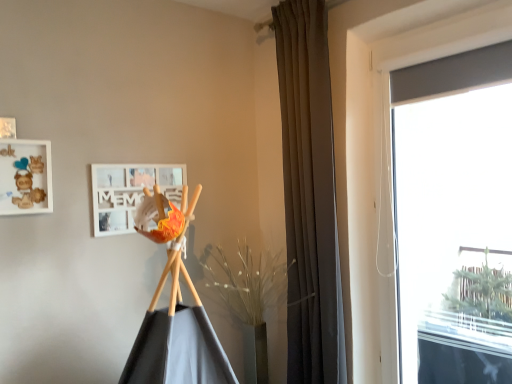
What do you see at coordinates (454, 217) in the screenshot? I see `transparent glass window at right` at bounding box center [454, 217].

Describe the element at coordinates (25, 177) in the screenshot. I see `wooden frame at upper left, marked as the 2th picture frame in a right-to-left arrangement` at that location.

Describe the element at coordinates (130, 193) in the screenshot. I see `white matte picture frame at upper center, which ranks as the second picture frame in front-to-back order` at that location.

Where is `brown fabric curtain at center`? This screenshot has width=512, height=384. brown fabric curtain at center is located at coordinates (309, 196).

In the scene shown: Between brown fabric curtain at center and wooden frame at upper left, the second picture frame viewed from the back, which one is positioned behind?

brown fabric curtain at center is behind.

Is brown fabric curtain at center oriented away from wooden frame at upper left, the second picture frame viewed from the back?

No, wooden frame at upper left, the second picture frame viewed from the back, is not at the back of brown fabric curtain at center.

I want to click on curtain on the right of wooden frame at upper left, the second picture frame viewed from the back, so click(309, 196).

Visually, is brown fabric curtain at center positioned to the left or to the right of wooden frame at upper left, marked as the 2th picture frame in a right-to-left arrangement?

Clearly, brown fabric curtain at center is on the right of wooden frame at upper left, marked as the 2th picture frame in a right-to-left arrangement, in the image.

Looking at this image, from the image's perspective, which one is positioned higher, transparent glass window at right or brown fabric curtain at center?

brown fabric curtain at center appears higher in the image.

Does transparent glass window at right appear on the right side of brown fabric curtain at center?

Correct, you'll find transparent glass window at right to the right of brown fabric curtain at center.

Is brown fabric curtain at center completely or partially inside transparent glass window at right?

Actually, brown fabric curtain at center is outside transparent glass window at right.

Considering the sizes of white matte picture frame at upper center, the first picture frame positioned from the right, and brown fabric curtain at center in the image, is white matte picture frame at upper center, the first picture frame positioned from the right, taller or shorter than brown fabric curtain at center?

Considering their sizes, white matte picture frame at upper center, the first picture frame positioned from the right, has less height than brown fabric curtain at center.

From the image's perspective, is white matte picture frame at upper center, which ranks as the second picture frame in front-to-back order, beneath brown fabric curtain at center?

No, from the image's perspective, white matte picture frame at upper center, which ranks as the second picture frame in front-to-back order, is not beneath brown fabric curtain at center.

In the scene shown: How different are the orientations of white matte picture frame at upper center, the first picture frame positioned from the right, and brown fabric curtain at center in degrees?

The facing directions of white matte picture frame at upper center, the first picture frame positioned from the right, and brown fabric curtain at center are 89.2 degrees apart.

From the image's perspective, count 1st picture frames upward from the brown fabric curtain at center and point to it. Please provide its 2D coordinates.

[(130, 193)]

From the image's perspective, would you say brown fabric curtain at center is shown under transparent glass window at right?

No, from the image's perspective, brown fabric curtain at center is not beneath transparent glass window at right.

How different are the orientations of brown fabric curtain at center and transparent glass window at right in degrees?

They differ by 1.17 degrees in their facing directions.

Considering the relative sizes of brown fabric curtain at center and transparent glass window at right in the image provided, is brown fabric curtain at center shorter than transparent glass window at right?

No.

The width and height of the screenshot is (512, 384). In order to click on curtain located behind the transparent glass window at right in this screenshot , I will do `click(309, 196)`.

From the image's perspective, is transparent glass window at right located above or below wooden frame at upper left, acting as the first picture frame starting from the front?

Clearly, from the image's perspective, transparent glass window at right is below wooden frame at upper left, acting as the first picture frame starting from the front.

Is transparent glass window at right outside of wooden frame at upper left, the second picture frame viewed from the back?

Absolutely, transparent glass window at right is external to wooden frame at upper left, the second picture frame viewed from the back.

Where is `window on the right of the wooden frame at upper left, which is the 1th picture frame from left to right`? This screenshot has height=384, width=512. window on the right of the wooden frame at upper left, which is the 1th picture frame from left to right is located at coordinates (454, 217).

Is transparent glass window at right with wooden frame at upper left, the second picture frame viewed from the back?

No, transparent glass window at right is not making contact with wooden frame at upper left, the second picture frame viewed from the back.

Does white matte picture frame at upper center, which ranks as the second picture frame in front-to-back order, have a larger size compared to transparent glass window at right?

Incorrect, white matte picture frame at upper center, which ranks as the second picture frame in front-to-back order, is not larger than transparent glass window at right.

Is white matte picture frame at upper center, the first picture frame positioned from the right, facing towards transparent glass window at right?

No, white matte picture frame at upper center, the first picture frame positioned from the right, is not oriented towards transparent glass window at right.

Is white matte picture frame at upper center, which ranks as the second picture frame in front-to-back order, spatially inside transparent glass window at right, or outside of it?

white matte picture frame at upper center, which ranks as the second picture frame in front-to-back order, cannot be found inside transparent glass window at right.

Would you consider white matte picture frame at upper center, which ranks as the second picture frame in front-to-back order, to be distant from transparent glass window at right?

white matte picture frame at upper center, which ranks as the second picture frame in front-to-back order, is positioned a significant distance from transparent glass window at right.

Is wooden frame at upper left, acting as the first picture frame starting from the front, not within white matte picture frame at upper center, which ranks as the second picture frame in front-to-back order?

Yes, wooden frame at upper left, acting as the first picture frame starting from the front, is located beyond the bounds of white matte picture frame at upper center, which ranks as the second picture frame in front-to-back order.

From the image's perspective, between wooden frame at upper left, the second picture frame viewed from the back, and white matte picture frame at upper center, the first picture frame positioned from the right, which one is located above?

From the image's view, wooden frame at upper left, the second picture frame viewed from the back, is above.

Where is `curtain that is under the wooden frame at upper left, acting as the first picture frame starting from the front (from a real-world perspective)`? The image size is (512, 384). curtain that is under the wooden frame at upper left, acting as the first picture frame starting from the front (from a real-world perspective) is located at coordinates (309, 196).

Where is `curtain located on the left of transparent glass window at right`? curtain located on the left of transparent glass window at right is located at coordinates (309, 196).

Considering their positions, is transparent glass window at right positioned further to wooden frame at upper left, which is the 1th picture frame from left to right, than white matte picture frame at upper center, positioned as the first picture frame in back-to-front order?

Based on the image, transparent glass window at right appears to be further to wooden frame at upper left, which is the 1th picture frame from left to right.

Estimate the real-world distances between objects in this image. Which object is closer to white matte picture frame at upper center, the second picture frame from the left, wooden frame at upper left, acting as the first picture frame starting from the front, or brown fabric curtain at center?

wooden frame at upper left, acting as the first picture frame starting from the front, lies closer to white matte picture frame at upper center, the second picture frame from the left, than the other object.

Considering their positions, is white matte picture frame at upper center, the second picture frame from the left, positioned closer to wooden frame at upper left, marked as the 2th picture frame in a right-to-left arrangement, than transparent glass window at right?

white matte picture frame at upper center, the second picture frame from the left, lies closer to wooden frame at upper left, marked as the 2th picture frame in a right-to-left arrangement, than the other object.

Looking at the image, which one is located closer to transparent glass window at right, white matte picture frame at upper center, positioned as the first picture frame in back-to-front order, or brown fabric curtain at center?

brown fabric curtain at center lies closer to transparent glass window at right than the other object.

Which object lies nearer to the anchor point wooden frame at upper left, which is the 1th picture frame from left to right, white matte picture frame at upper center, which ranks as the second picture frame in front-to-back order, or brown fabric curtain at center?

white matte picture frame at upper center, which ranks as the second picture frame in front-to-back order, is positioned closer to the anchor wooden frame at upper left, which is the 1th picture frame from left to right.

Estimate the real-world distances between objects in this image. Which object is further from wooden frame at upper left, which is the 1th picture frame from left to right, brown fabric curtain at center or transparent glass window at right?

transparent glass window at right is positioned further to the anchor wooden frame at upper left, which is the 1th picture frame from left to right.

Looking at this image, estimate the real-world distances between objects in this image. Which object is further from brown fabric curtain at center, white matte picture frame at upper center, positioned as the first picture frame in back-to-front order, or wooden frame at upper left, which is the 1th picture frame from left to right?

The object further to brown fabric curtain at center is wooden frame at upper left, which is the 1th picture frame from left to right.

Which object lies nearer to the anchor point white matte picture frame at upper center, the first picture frame positioned from the right, transparent glass window at right or wooden frame at upper left, acting as the first picture frame starting from the front?

wooden frame at upper left, acting as the first picture frame starting from the front, is closer to white matte picture frame at upper center, the first picture frame positioned from the right.

In order to click on curtain between white matte picture frame at upper center, positioned as the first picture frame in back-to-front order, and transparent glass window at right from left to right in this screenshot , I will do `click(309, 196)`.

Where is `picture frame located between wooden frame at upper left, the second picture frame viewed from the back, and brown fabric curtain at center in the left-right direction`? The width and height of the screenshot is (512, 384). picture frame located between wooden frame at upper left, the second picture frame viewed from the back, and brown fabric curtain at center in the left-right direction is located at coordinates (130, 193).

You are a GUI agent. You are given a task and a screenshot of the screen. Output one action in this format:
    pyautogui.click(x=<x>, y=<y>)
    Task: Click on the picture frame between wooden frame at upper left, which is the 1th picture frame from left to right, and transparent glass window at right, in the horizontal direction
    
    Given the screenshot: What is the action you would take?
    pyautogui.click(x=130, y=193)

The width and height of the screenshot is (512, 384). Identify the location of curtain between wooden frame at upper left, acting as the first picture frame starting from the front, and transparent glass window at right, in the horizontal direction. (309, 196).